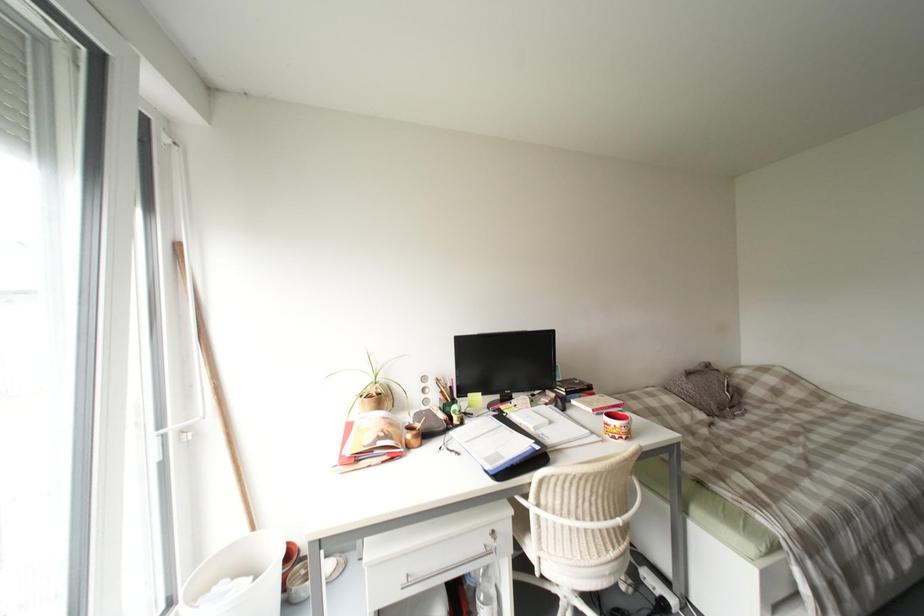
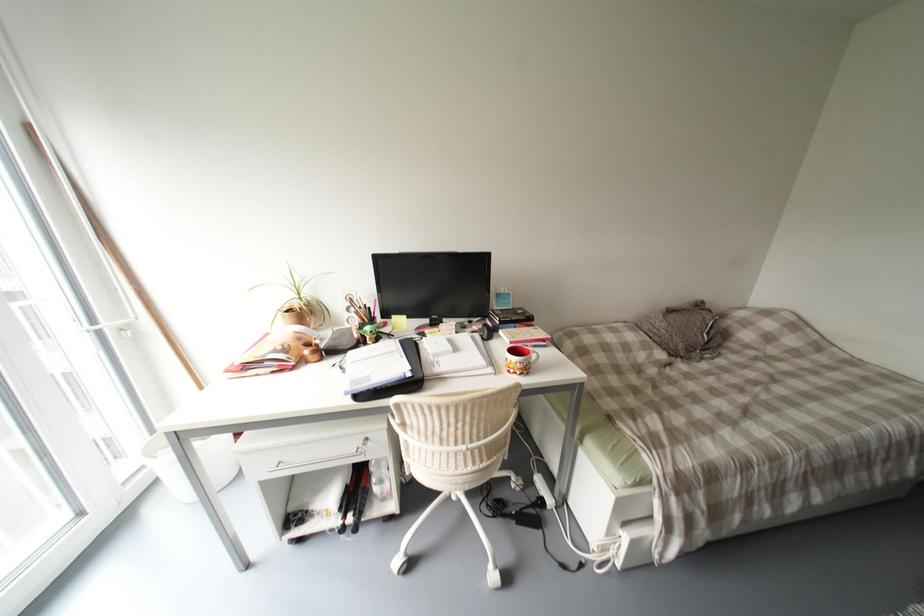
Question: The images are taken continuously from a first-person perspective. In which direction are you moving?

Choices:
 (A) Left
 (B) Right
 (C) Forward
 (D) Backward

Answer: (B)